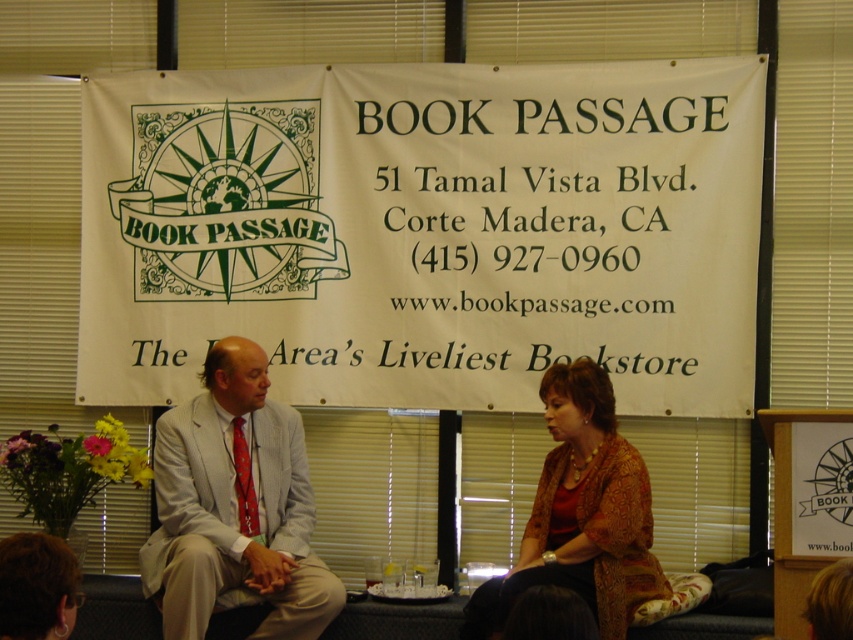
Between point (222, 531) and point (614, 609), which one is positioned in front?

Point (614, 609) is more forward.

The width and height of the screenshot is (853, 640). What are the coordinates of `light gray suit at center` in the screenshot? It's located at 235,506.

Does white paper banner at upper center appear on the right side of brown textured sweater at center?

Incorrect, white paper banner at upper center is not on the right side of brown textured sweater at center.

Who is taller, white paper banner at upper center or brown textured sweater at center?

white paper banner at upper center

Identify the location of white paper banner at upper center. (425, 230).

This screenshot has width=853, height=640. What do you see at coordinates (425, 230) in the screenshot?
I see `white paper banner at upper center` at bounding box center [425, 230].

The height and width of the screenshot is (640, 853). What do you see at coordinates (425, 230) in the screenshot?
I see `white paper banner at upper center` at bounding box center [425, 230].

Image resolution: width=853 pixels, height=640 pixels. Identify the location of white paper banner at upper center. (425, 230).